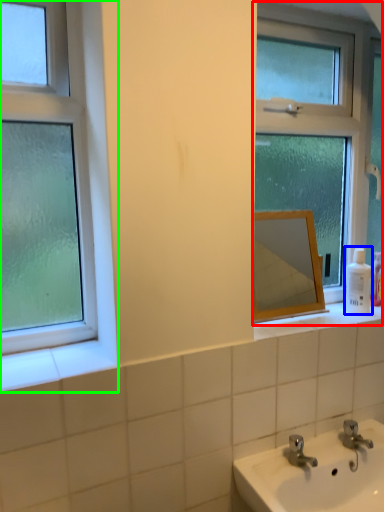
Question: Based on their relative distances, which object is nearer to window (highlighted by a red box)? Choose from toiletry (highlighted by a blue box) and window (highlighted by a green box).

Choices:
 (A) toiletry
 (B) window

Answer: (A)